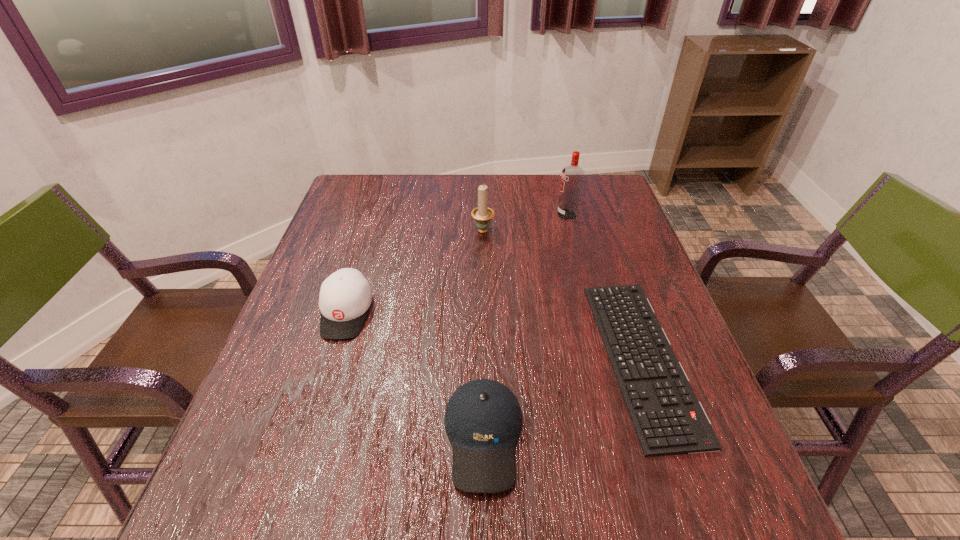
This screenshot has height=540, width=960. I want to click on the farthest object, so click(x=572, y=177).

You are a GUI agent. You are given a task and a screenshot of the screen. Output one action in this format:
    pyautogui.click(x=<x>, y=<y>)
    Task: Click on the tallest object
    The width and height of the screenshot is (960, 540).
    Given the screenshot: What is the action you would take?
    pyautogui.click(x=572, y=177)

Find the location of a particular element. This screenshot has height=540, width=960. the second farthest object is located at coordinates (482, 214).

I want to click on candle_holder, so click(x=482, y=214).

Find the location of `the leftmost object`. the leftmost object is located at coordinates (345, 296).

This screenshot has width=960, height=540. I want to click on the farther baseball cap, so click(345, 296).

Where is `the fourth tallest object`? The image size is (960, 540). the fourth tallest object is located at coordinates (483, 420).

Where is `the shorter baseball cap`? the shorter baseball cap is located at coordinates (483, 420).

Where is `computer keyboard`? computer keyboard is located at coordinates (668, 419).

Image resolution: width=960 pixels, height=540 pixels. Find the location of `vacant space located on the front label of the tallest object`. vacant space located on the front label of the tallest object is located at coordinates (428, 214).